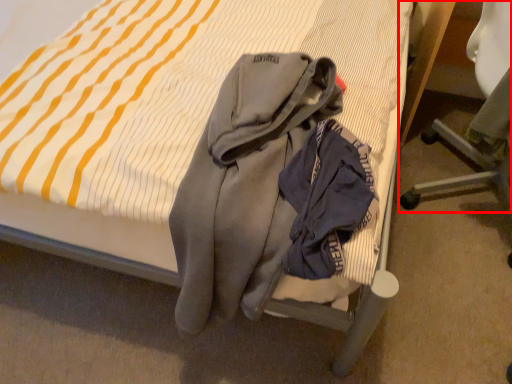
Question: From the image, what is the correct spatial relationship of chair (annotated by the red box) in relation to garment?

Choices:
 (A) right
 (B) left

Answer: (A)